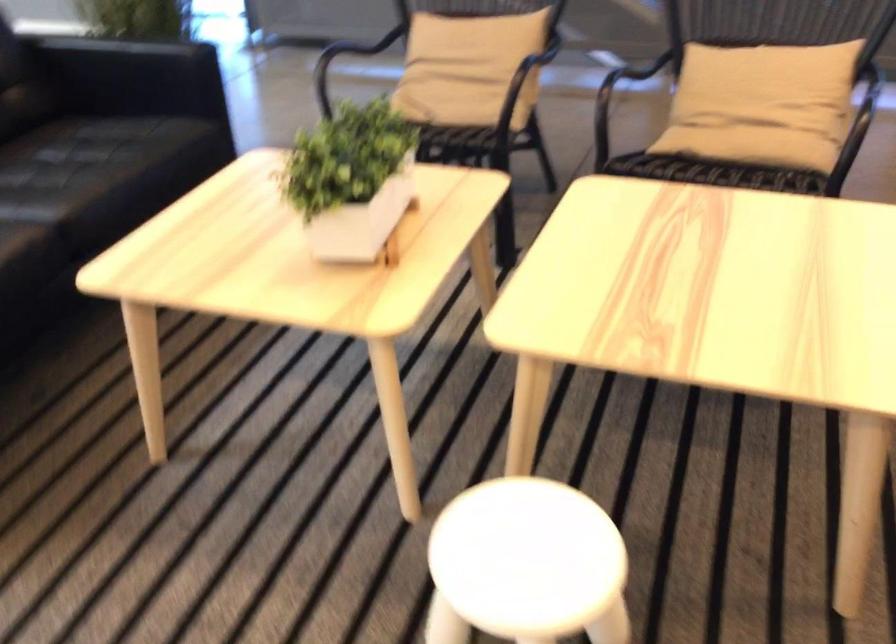
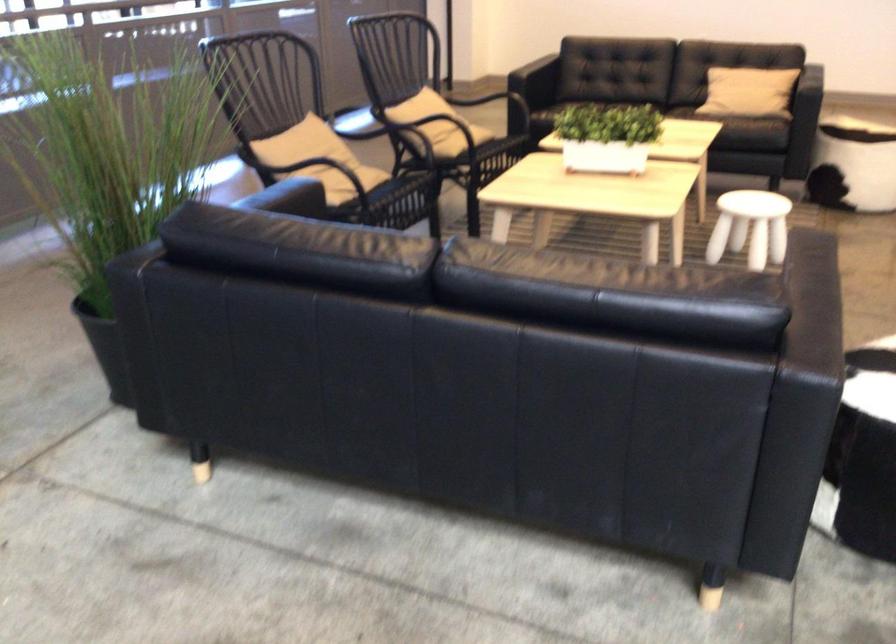
Locate, in the second image, the point that corresponds to the point at 444,544 in the first image.

(750, 227)